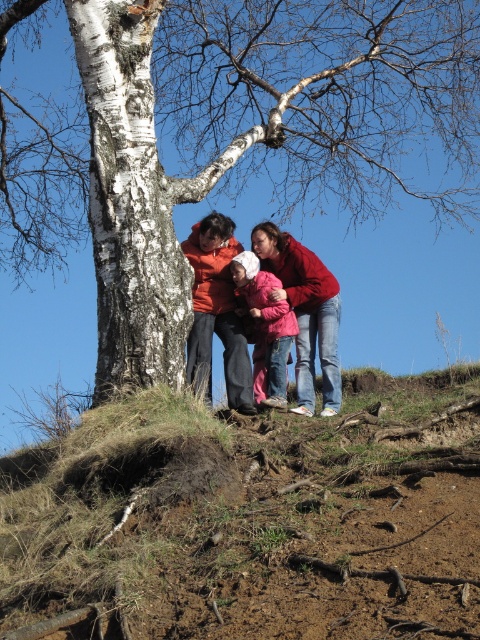
Question: Is dried grass at center below white bark tree at center?

Choices:
 (A) yes
 (B) no

Answer: (A)

Question: Which point is farther from the camera taking this photo?

Choices:
 (A) 93,99
 (B) 154,595

Answer: (A)

Question: Is dried grass at center positioned before pink fleece jacket at center?

Choices:
 (A) yes
 (B) no

Answer: (A)

Question: Estimate the real-world distances between objects in this image. Which object is closer to the matte orange sweater at center?

Choices:
 (A) dried grass at center
 (B) pink fleece jacket at center

Answer: (B)

Question: Which point is closer to the camera?

Choices:
 (A) (256, 301)
 (B) (361, 100)
 (C) (312, 262)
 (D) (332, 493)

Answer: (D)

Question: Is dried grass at center positioned behind pink fleece jacket at center?

Choices:
 (A) yes
 (B) no

Answer: (B)